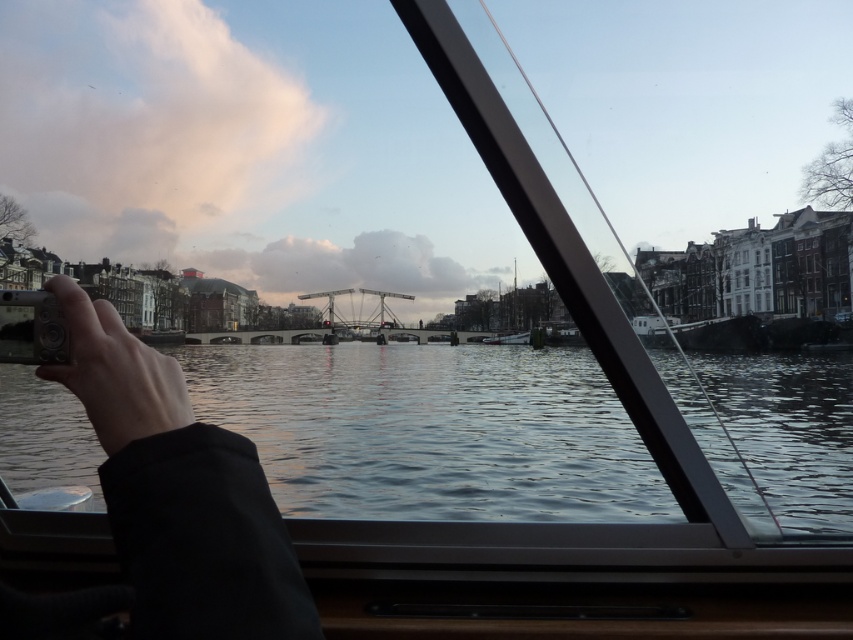
Question: Among these objects, which one is nearest to the camera?

Choices:
 (A) matte black camera at lower left
 (B) glossy water at center
 (C) metallic silver camera at lower left

Answer: (A)

Question: Which point is closer to the camera?

Choices:
 (A) matte black camera at lower left
 (B) metallic silver camera at lower left
 (C) glossy water at center

Answer: (A)

Question: Considering the relative positions of glossy water at center and metallic silver camera at lower left in the image provided, where is glossy water at center located with respect to metallic silver camera at lower left?

Choices:
 (A) below
 (B) above

Answer: (A)

Question: From the image, what is the correct spatial relationship of glossy water at center in relation to matte black camera at lower left?

Choices:
 (A) right
 (B) left

Answer: (B)

Question: Does glossy water at center have a lesser width compared to metallic silver camera at lower left?

Choices:
 (A) yes
 (B) no

Answer: (B)

Question: Which is nearer to the glossy water at center?

Choices:
 (A) metallic silver camera at lower left
 (B) matte black camera at lower left

Answer: (B)